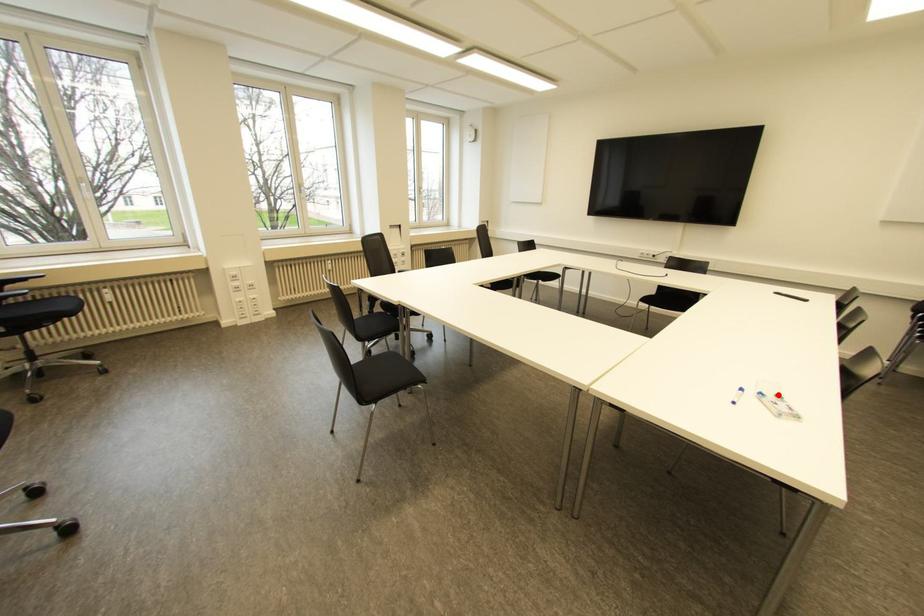
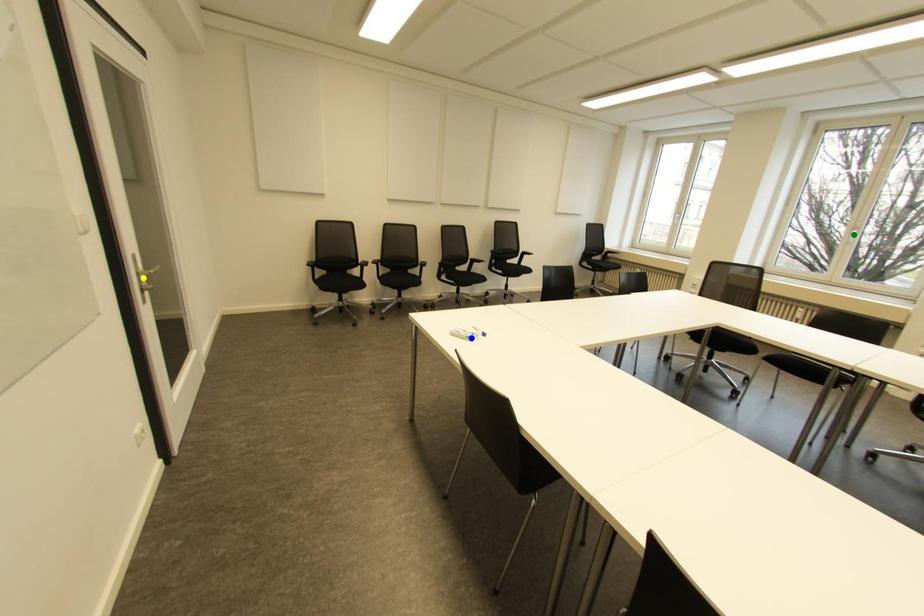
Question: I am providing you with two images of the same scene from different viewpoints. A red point is marked on the first image. You are given multiple points on the second image. Which spot in image 2 lines up with the point in image 1?

Choices:
 (A) green point
 (B) yellow point
 (C) blue point

Answer: (C)